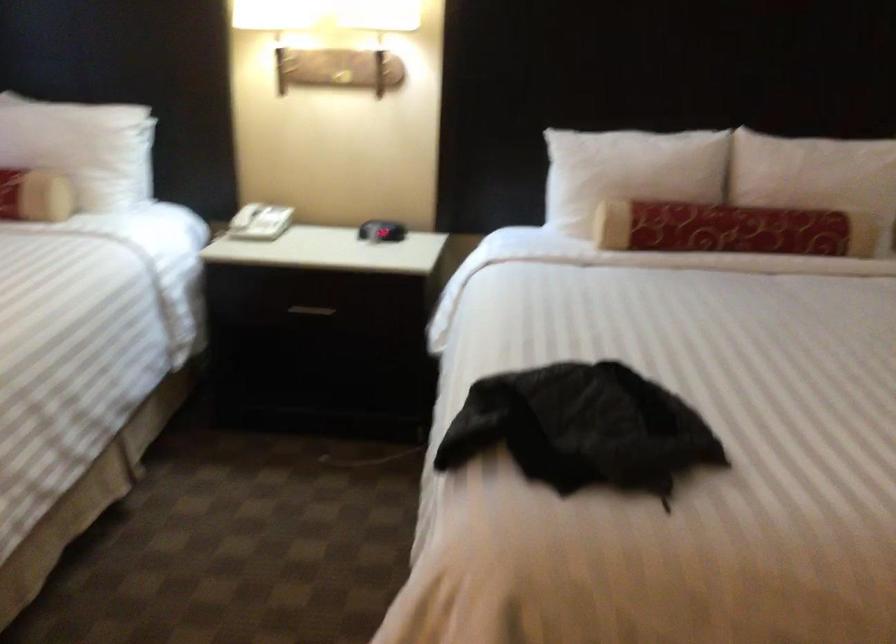
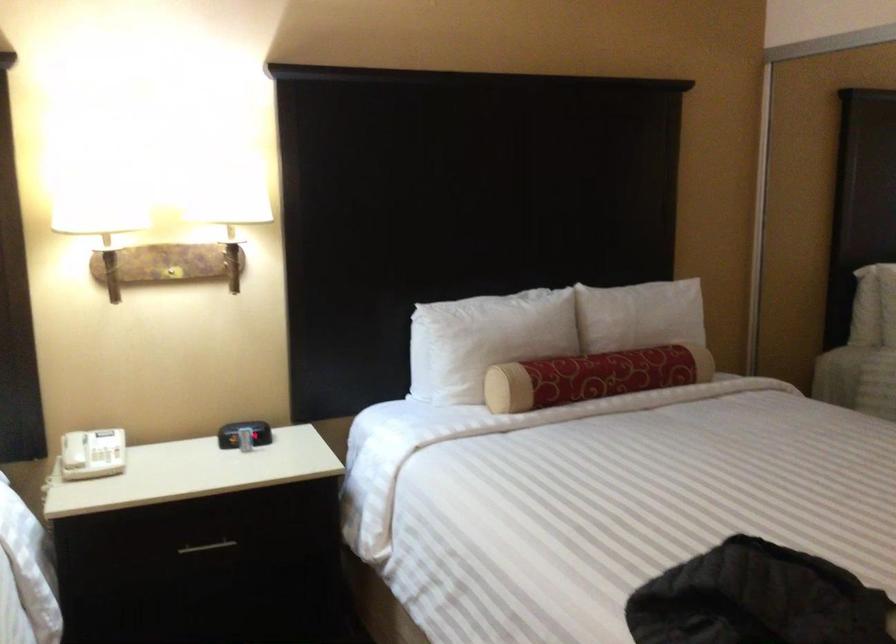
Find the pixel in the second image that matches pixel 807 172 in the first image.

(643, 319)